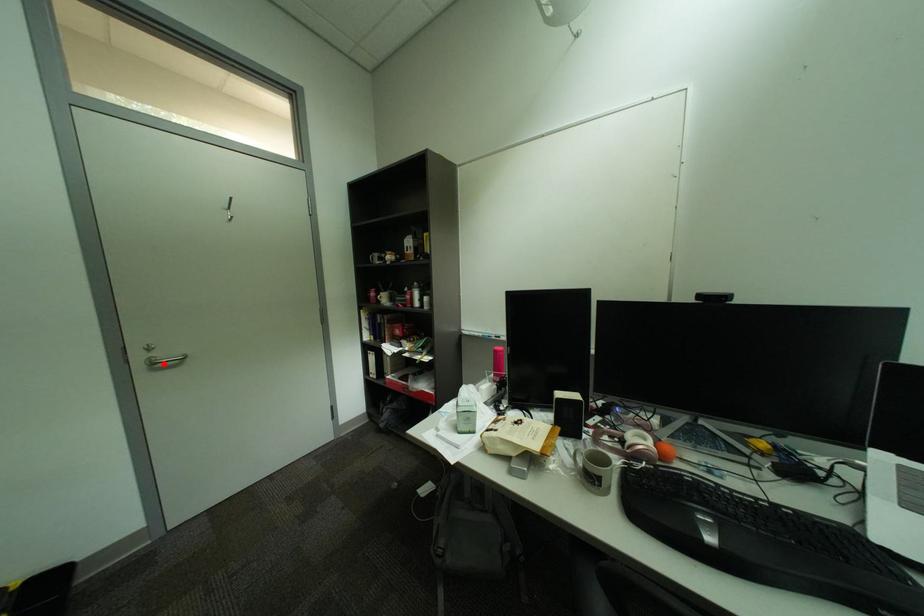
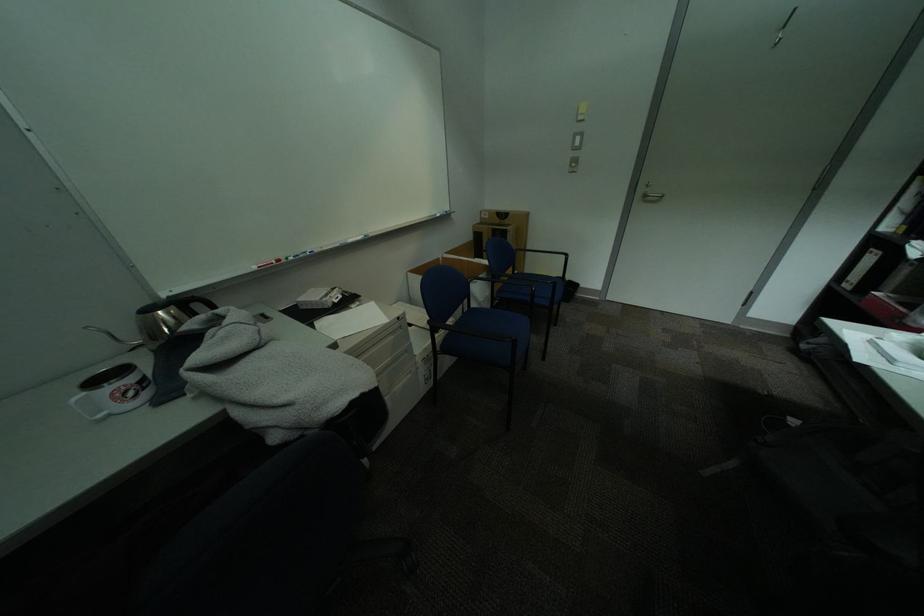
Find the pixel in the second image that matches the highlighted location in the first image.

(655, 197)